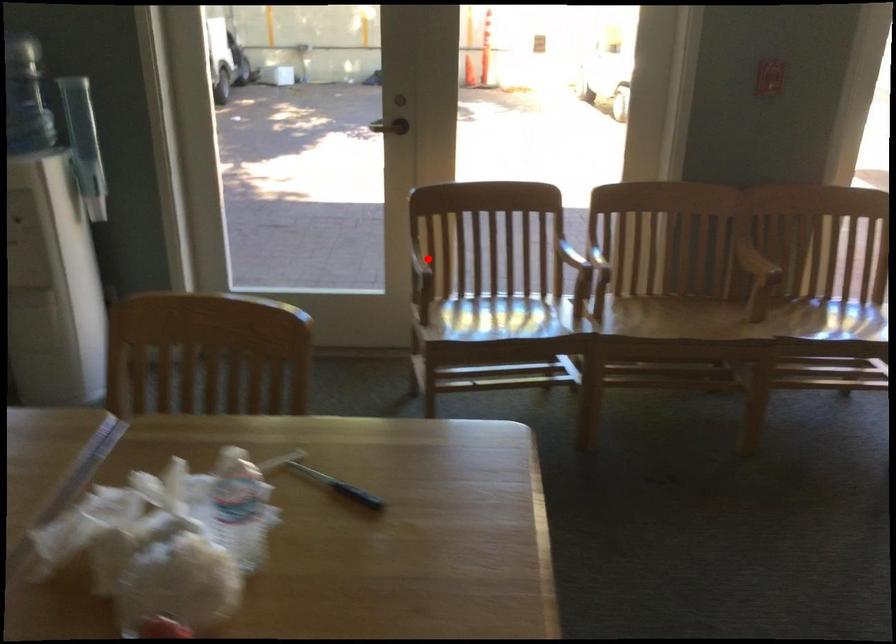
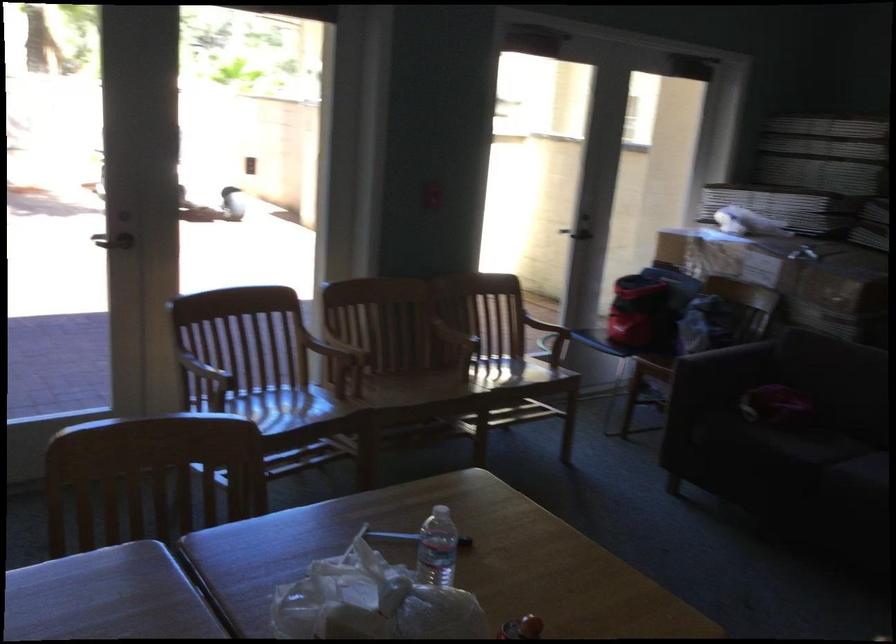
Find the pixel in the second image that matches the highlighted location in the first image.

(205, 371)